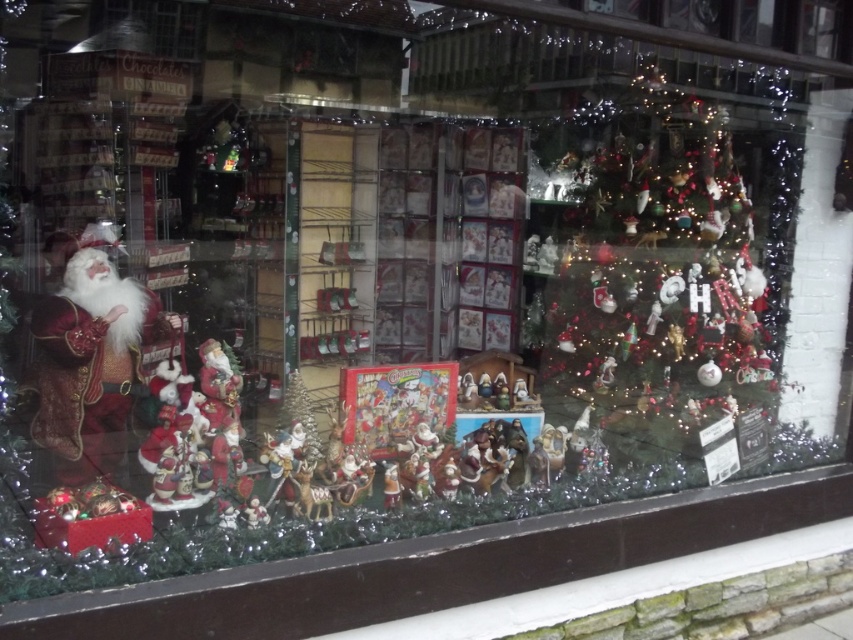
Is iridescent glass ornaments at upper right bigger than velvet red santa claus at left?

Yes.

Is point (709, 266) behind point (90, 390)?

Yes, it is.

What do you see at coordinates (664, 262) in the screenshot? This screenshot has width=853, height=640. I see `iridescent glass ornaments at upper right` at bounding box center [664, 262].

You are a GUI agent. You are given a task and a screenshot of the screen. Output one action in this format:
    pyautogui.click(x=<x>, y=<y>)
    Task: Click on the iridescent glass ornaments at upper right
    This screenshot has height=640, width=853.
    Given the screenshot: What is the action you would take?
    coord(664,262)